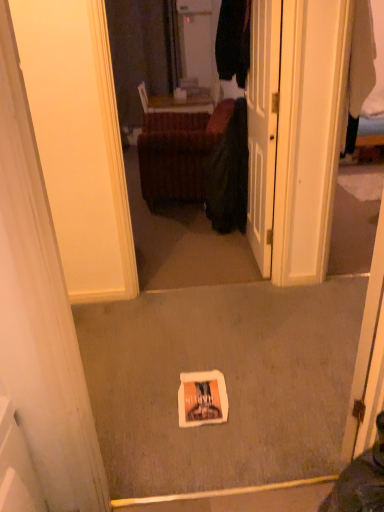
The image size is (384, 512). What are the coordinates of `vacant space to the left of white glossy door at center` in the screenshot? It's located at (182, 252).